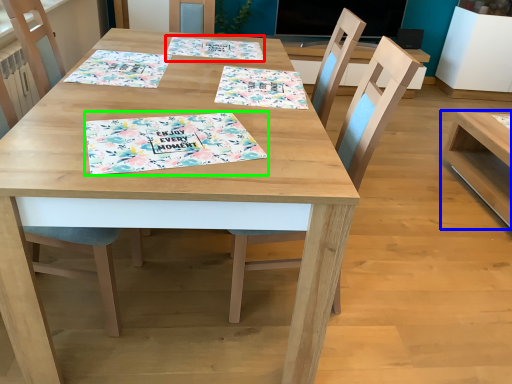
Question: Based on their relative distances, which object is farther from tablecloth (highlighted by a red box)? Choose from table (highlighted by a blue box) and place mat (highlighted by a green box).

Choices:
 (A) table
 (B) place mat

Answer: (A)